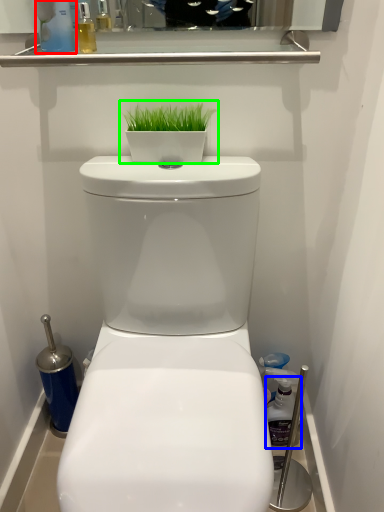
Question: Which object is the closest to the cleaning product (highlighted by a red box)? Choose among these: cleaning product (highlighted by a blue box) or houseplant (highlighted by a green box).

Choices:
 (A) cleaning product
 (B) houseplant

Answer: (B)